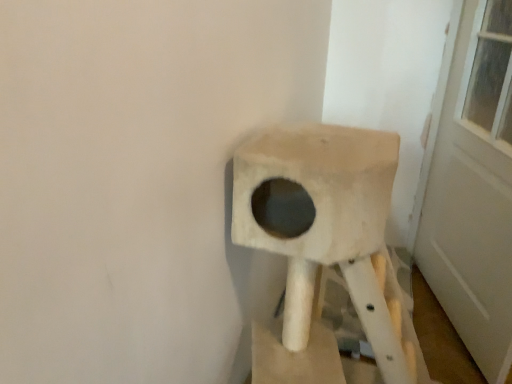
Question: From a real-world perspective, is beige fabric cat tree at center physically located above or below white matte door at upper right?

Choices:
 (A) above
 (B) below

Answer: (B)

Question: In terms of height, does beige fabric cat tree at center look taller or shorter compared to white matte door at upper right?

Choices:
 (A) tall
 (B) short

Answer: (B)

Question: Is beige fabric cat tree at center situated inside white matte door at upper right or outside?

Choices:
 (A) outside
 (B) inside

Answer: (A)

Question: Would you say white matte door at upper right is to the left or to the right of beige fabric cat tree at center in the picture?

Choices:
 (A) right
 (B) left

Answer: (A)

Question: Based on their sizes in the image, would you say white matte door at upper right is bigger or smaller than beige fabric cat tree at center?

Choices:
 (A) big
 (B) small

Answer: (B)

Question: From a real-world perspective, relative to beige fabric cat tree at center, is white matte door at upper right vertically above or below?

Choices:
 (A) above
 (B) below

Answer: (A)

Question: Considering the positions of white matte door at upper right and beige fabric cat tree at center in the image, is white matte door at upper right taller or shorter than beige fabric cat tree at center?

Choices:
 (A) tall
 (B) short

Answer: (A)